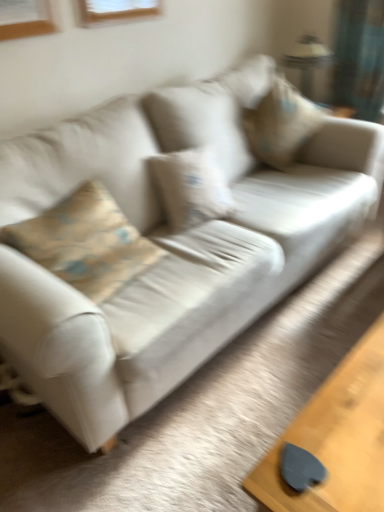
Question: In terms of height, does metallic silver lamp at upper right look taller or shorter compared to smooth wooden table at lower right?

Choices:
 (A) short
 (B) tall

Answer: (B)

Question: Is point (296, 51) positioned closer to the camera than point (276, 445)?

Choices:
 (A) farther
 (B) closer

Answer: (A)

Question: Estimate the real-world distances between objects in this image. Which object is farther from the smooth wooden table at lower right?

Choices:
 (A) beige fabric pillow at upper right
 (B) metallic silver lamp at upper right

Answer: (B)

Question: Which of these objects is positioned farthest from the metallic silver lamp at upper right?

Choices:
 (A) beige fabric pillow at upper right
 (B) smooth wooden table at lower right

Answer: (B)